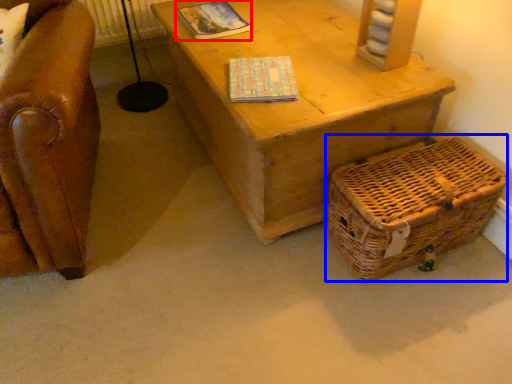
Question: Which object appears closest to the camera in this image, magazine (highlighted by a red box) or basket (highlighted by a blue box)?

Choices:
 (A) magazine
 (B) basket

Answer: (B)